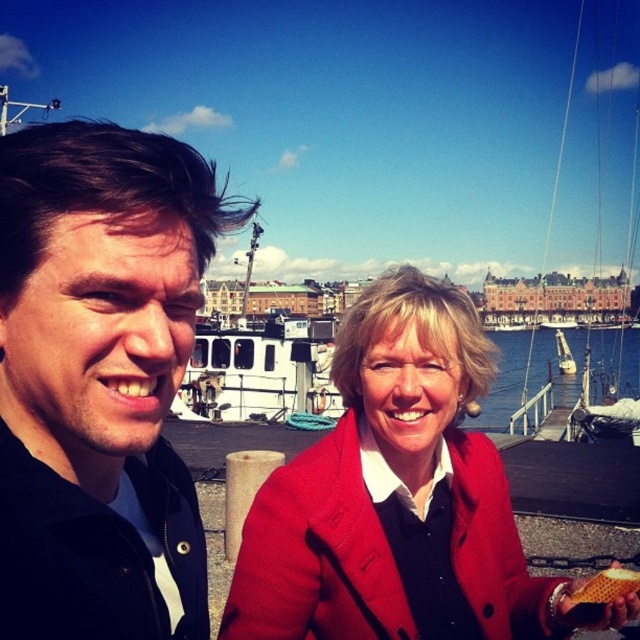
Please describe the location of the blue water at center in the image using coordinates. The scene has a man on the left and a woman on the right, with boats in the background.

The blue water at center is located at coordinates point (241, 376).

You are a photographer trying to capture a photo of the blue water at center and the golden honeycomb at lower right. Which object should you focus on first if you want to include both in your frame without moving the camera?

You should focus on the golden honeycomb at lower right first because the blue water at center is positioned on the right side of the golden honeycomb at lower right, meaning it is closer to the camera. By focusing on the closer object first, you can ensure both are in the frame without needing to adjust the camera position.